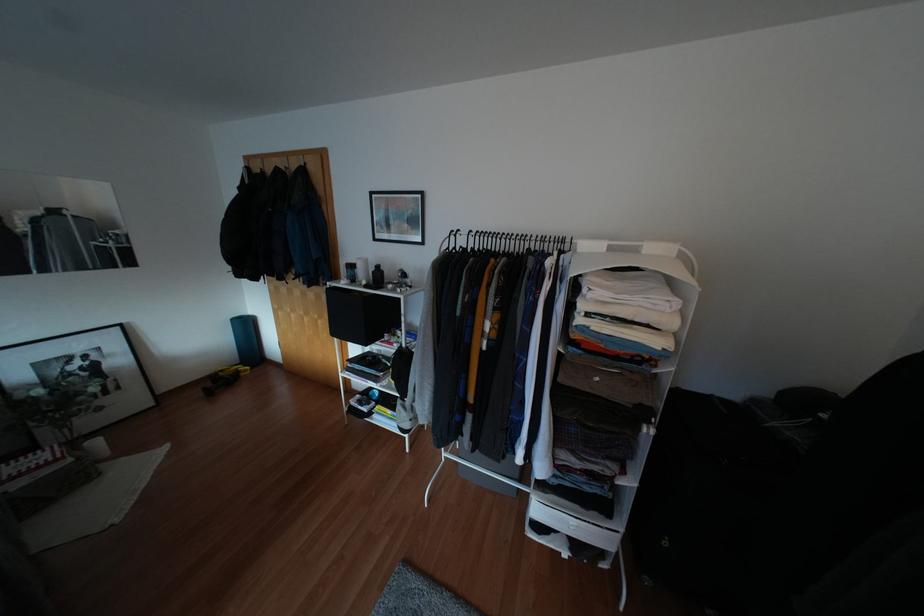
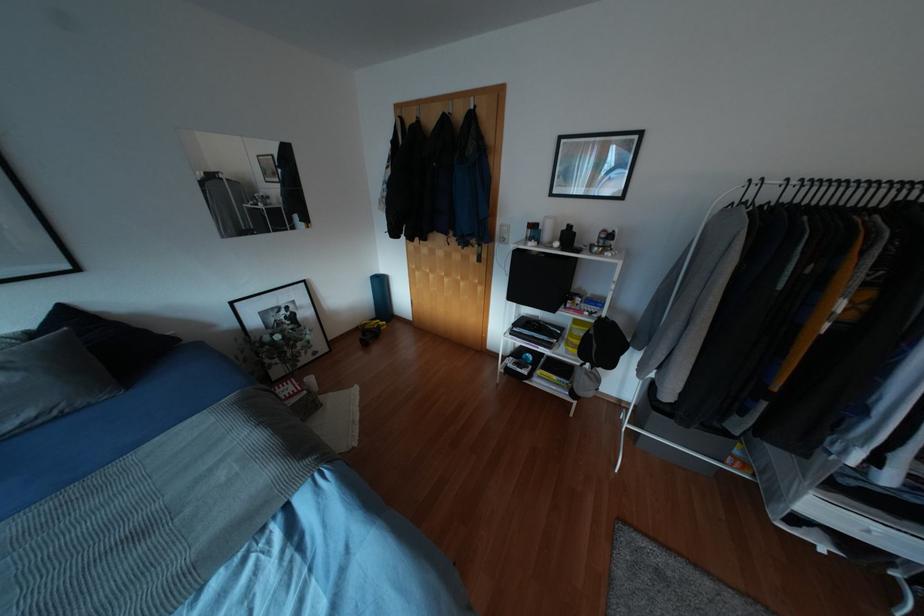
Question: The images are taken continuously from a first-person perspective. In which direction are you moving?

Choices:
 (A) Left
 (B) Right
 (C) Forward
 (D) Backward

Answer: (A)